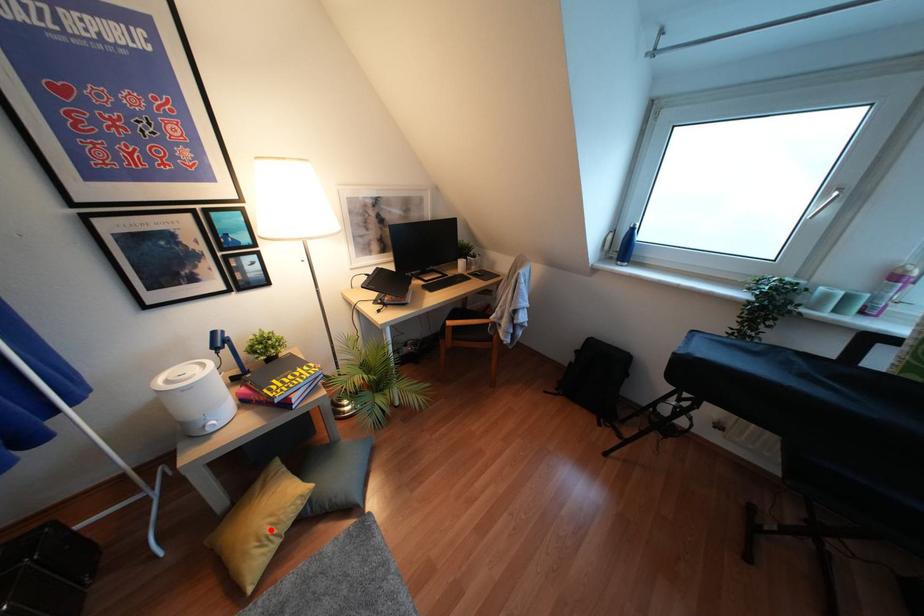
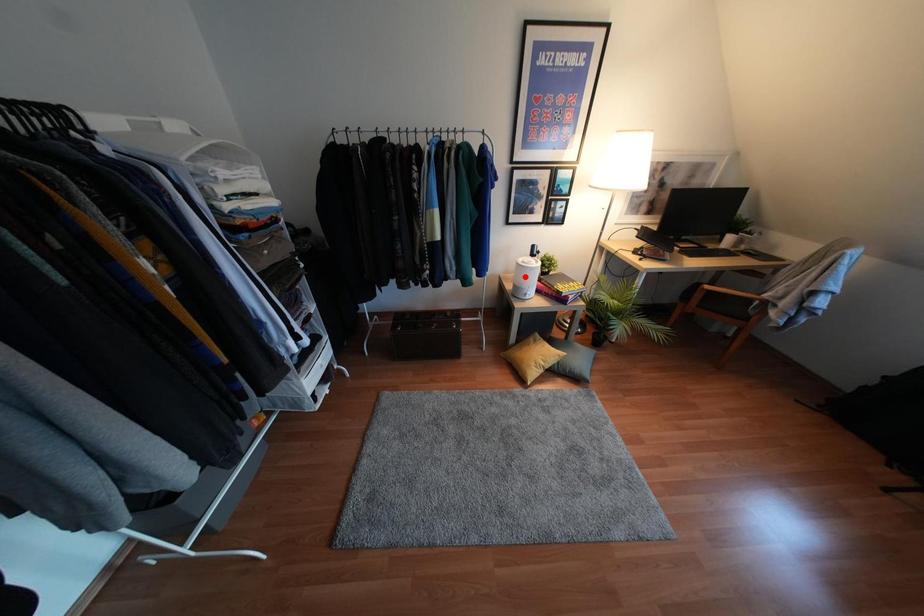
I am providing you with two images of the same scene from different viewpoints. A red point is marked on the first image and another point is marked on the second image. Does the point marked in image1 correspond to the same location as the one in image2?

No